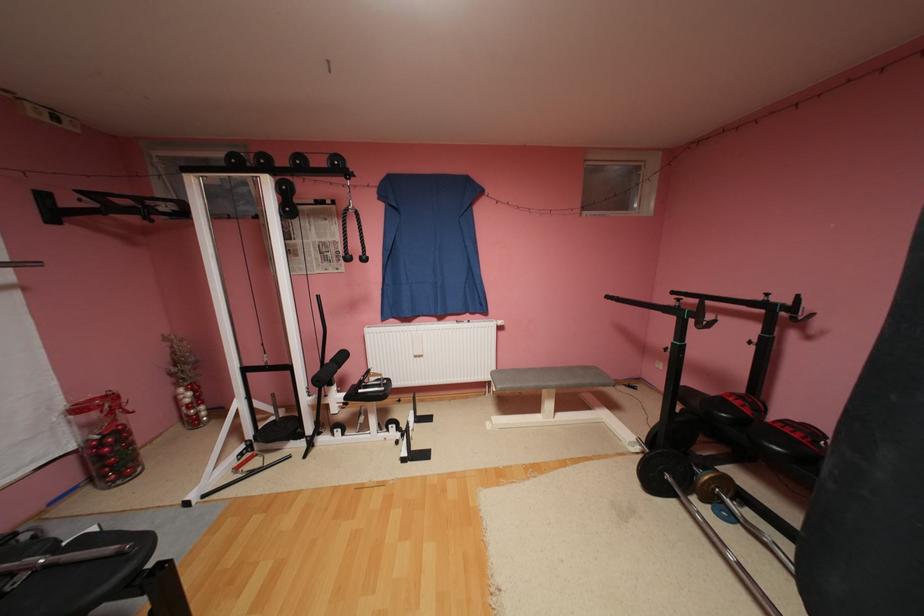
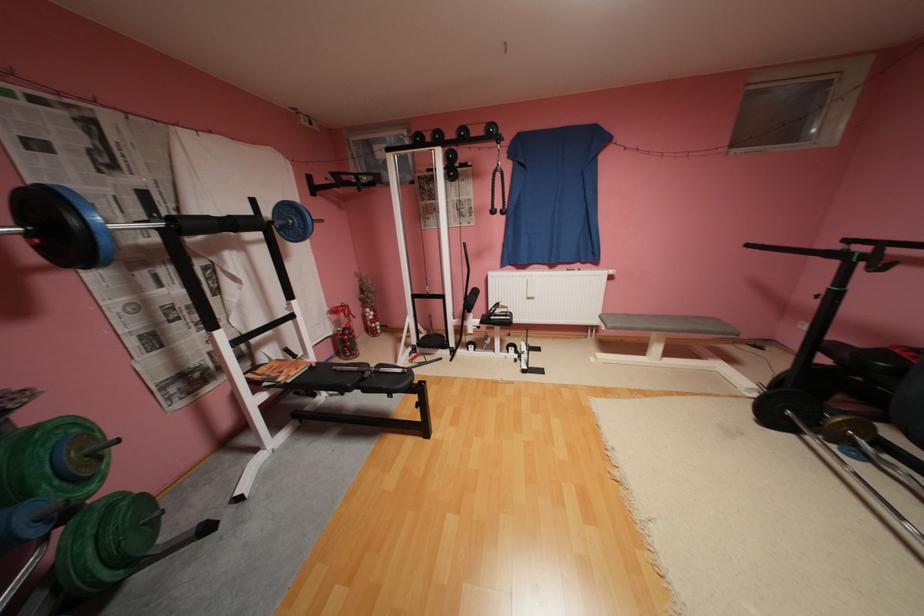
In a continuous first-person perspective shot, in which direction is the camera moving?

The cameraman moved toward left, backward.